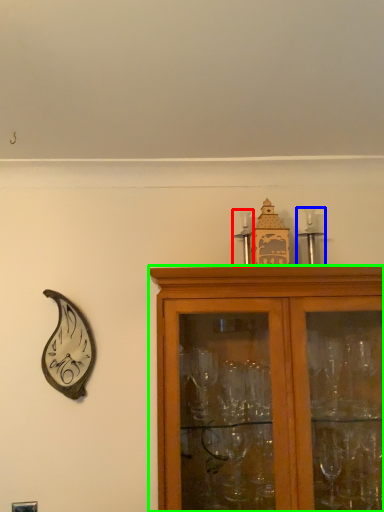
Question: Estimate the real-world distances between objects in this image. Which object is farther from candle holder (highlighted by a red box), candle holder (highlighted by a blue box) or cabinetry (highlighted by a green box)?

Choices:
 (A) candle holder
 (B) cabinetry

Answer: (B)